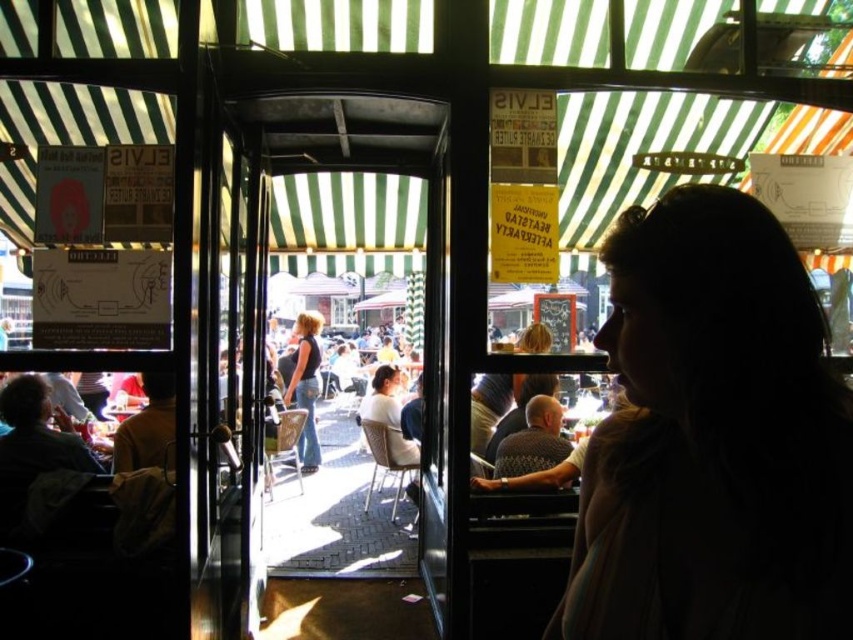
Which of these two, silhouette hair at right or transparent glass door at center, stands shorter?

With less height is transparent glass door at center.

Who is positioned more to the right, silhouette hair at right or transparent glass door at center?

silhouette hair at right is more to the right.

Between point (618, 282) and point (378, 147), which one is positioned in front?

Point (618, 282)

Locate an element on the screen. This screenshot has height=640, width=853. silhouette hair at right is located at coordinates (712, 440).

Between transparent glass door at center and denim jeans at center, which one has more height?

Standing taller between the two is denim jeans at center.

Is point (366, 292) in front of point (294, 333)?

No.

Where is `transparent glass door at center`? transparent glass door at center is located at coordinates (357, 168).

Can you confirm if silhouette hair at right is taller than denim jeans at center?

No.

Is silhouette hair at right behind denim jeans at center?

No, it is in front of denim jeans at center.

Who is more forward, (664,428) or (314,369)?

Positioned in front is point (664,428).

At what (x,y) coordinates should I click in order to perform the action: click on silhouette hair at right. Please return your answer as a coordinate pair (x, y). The width and height of the screenshot is (853, 640). Looking at the image, I should click on (712, 440).